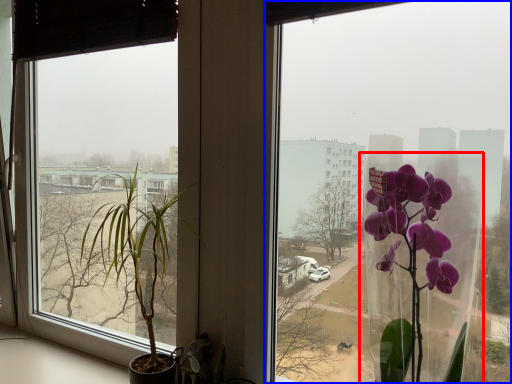
Question: Which of the following is the farthest to the observer, glass vase (highlighted by a red box) or window (highlighted by a blue box)?

Choices:
 (A) glass vase
 (B) window

Answer: (B)